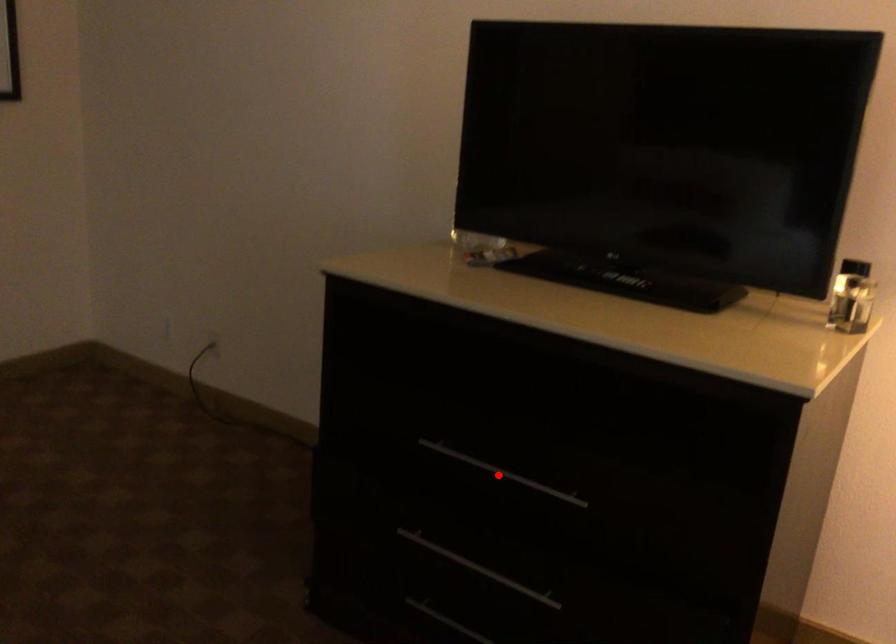
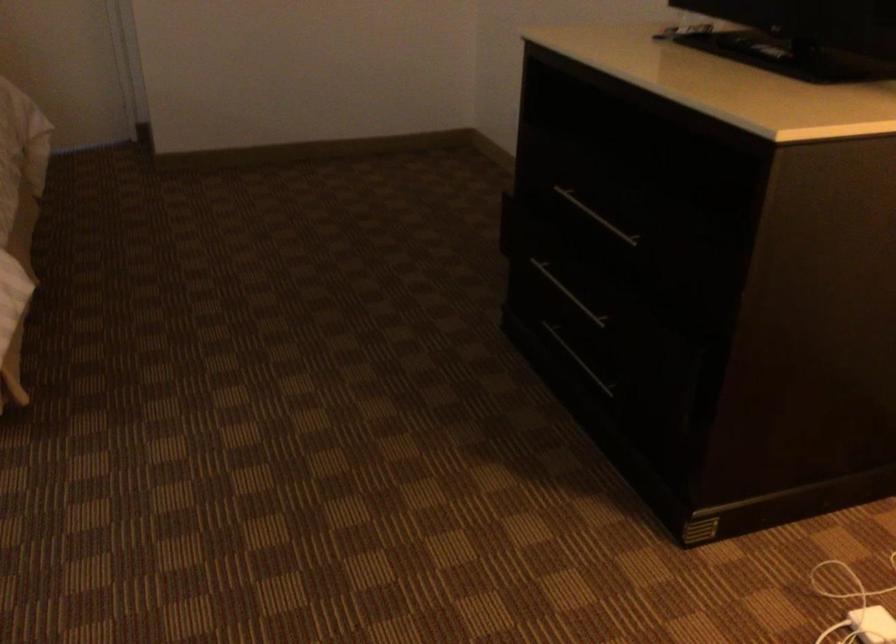
Question: A red point is marked in image1. In image2, is the corresponding 3D point closer to the camera or farther? Reply with the corresponding letter.

Choices:
 (A) The corresponding 3D point is closer.
 (B) The corresponding 3D point is farther.

Answer: (B)